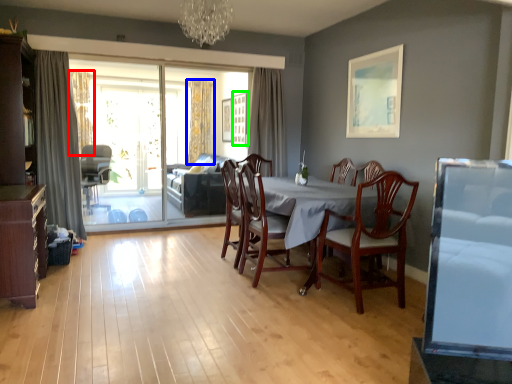
Question: Which is nearer to the curtain (highlighted by a red box)? curtain (highlighted by a blue box) or picture frame (highlighted by a green box).

Choices:
 (A) curtain
 (B) picture frame

Answer: (A)